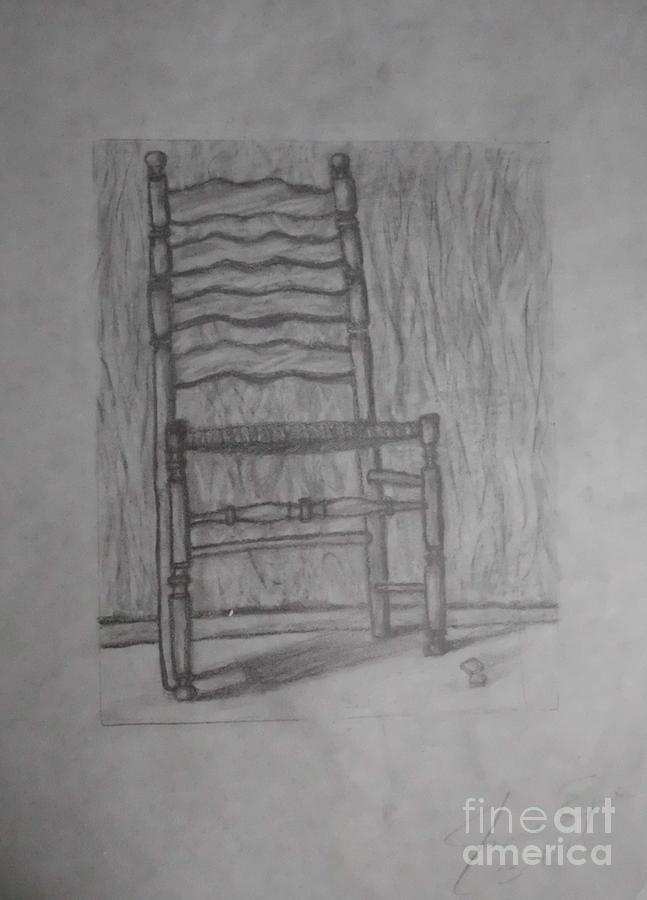
The image size is (647, 900). Find the location of `wicker seat on chair`. wicker seat on chair is located at coordinates (376, 428).